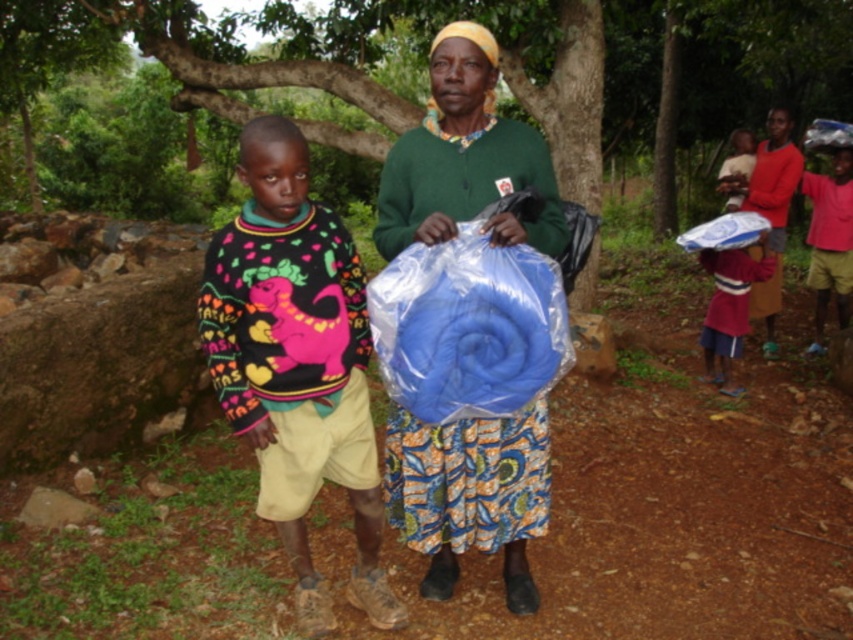
Can you confirm if multicolored sweater at left is positioned to the left of matte green sweater at center?

Correct, you'll find multicolored sweater at left to the left of matte green sweater at center.

The height and width of the screenshot is (640, 853). Describe the element at coordinates (296, 362) in the screenshot. I see `multicolored sweater at left` at that location.

Identify the location of multicolored sweater at left. The width and height of the screenshot is (853, 640). (296, 362).

Between matte green sweater at center and matte blue fabric at right, which one has less height?

matte green sweater at center is shorter.

Is matte green sweater at center shorter than matte blue fabric at right?

Yes, matte green sweater at center is shorter than matte blue fabric at right.

Between point (439, 211) and point (770, 193), which one is positioned behind?

The point (770, 193) is behind.

This screenshot has height=640, width=853. In order to click on matte green sweater at center in this screenshot , I will do `click(466, 157)`.

Is multicolored sweater at left wider than matte pink sweater at upper right?

In fact, multicolored sweater at left might be narrower than matte pink sweater at upper right.

Is multicolored sweater at left above matte pink sweater at upper right?

Actually, multicolored sweater at left is below matte pink sweater at upper right.

This screenshot has height=640, width=853. Find the location of `multicolored sweater at left`. multicolored sweater at left is located at coordinates (296, 362).